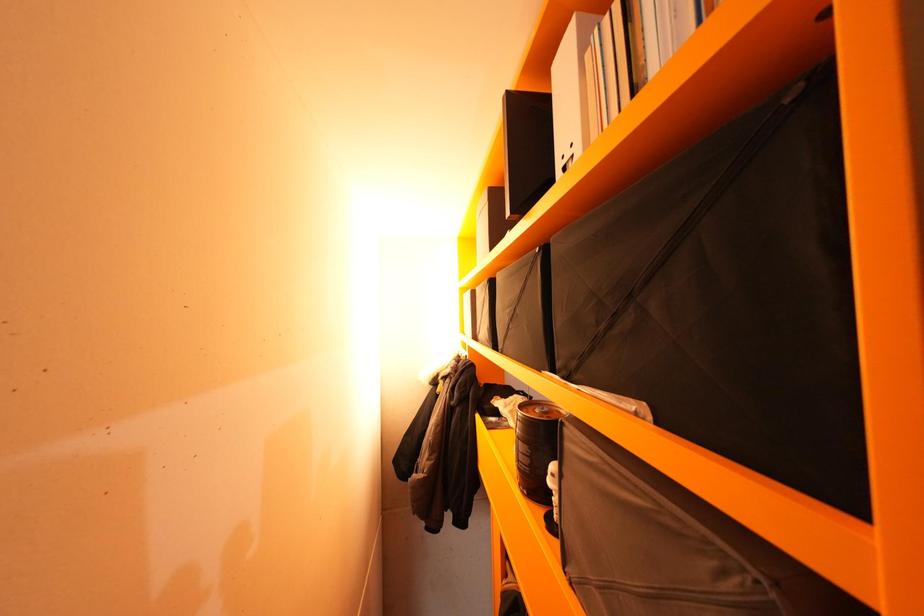
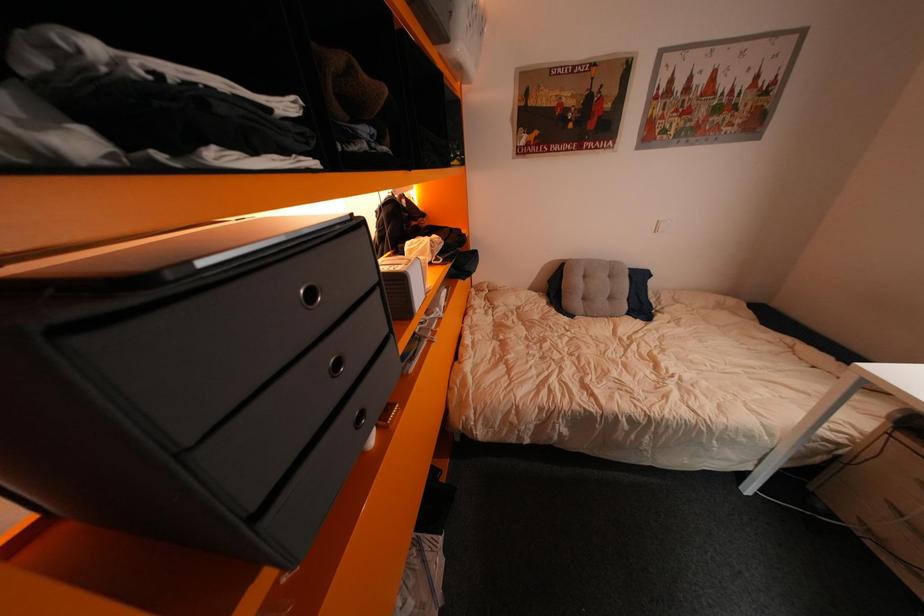
How did the camera likely rotate?

The camera's rotation is toward left-down.